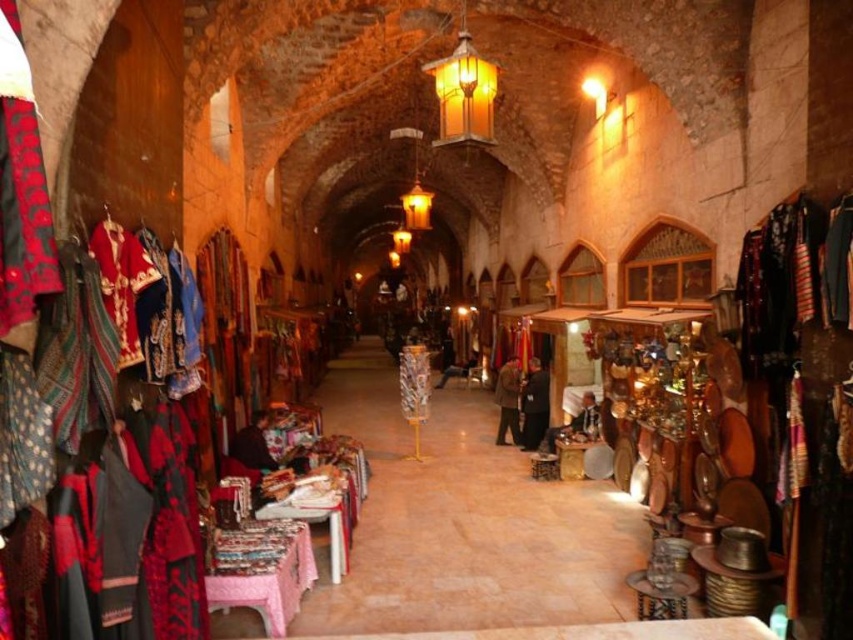
You are a customer in the marketplace and want to buy both the black fabric at center and the brown wool coat at center. Which item is positioned higher up?

The black fabric at center is located above the brown wool coat at center, so it is positioned higher up.

You are a vendor at the marketplace and want to display both the black fabric at center and the brown wool coat at center on a single table. Given that the table can only accommodate items up to the size of the larger object, will both items fit on the table?

The black fabric at center has a larger width than the brown wool coat at center. Since the table can only accommodate items up to the size of the larger object, the black fabric at center will occupy the maximum space required. Therefore, both items can fit on the table as long as the table is at least as wide as the black fabric at center.